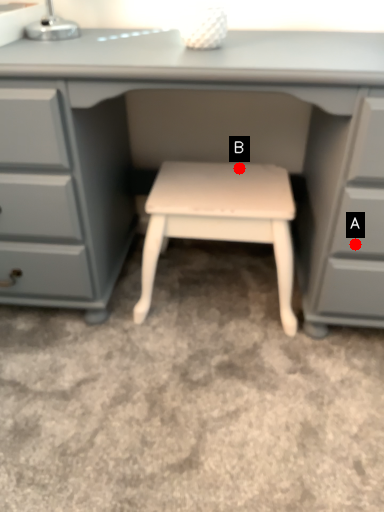
Question: Two points are circled on the image, labeled by A and B beside each circle. Which point is closer to the camera taking this photo?

Choices:
 (A) A is closer
 (B) B is closer

Answer: (A)